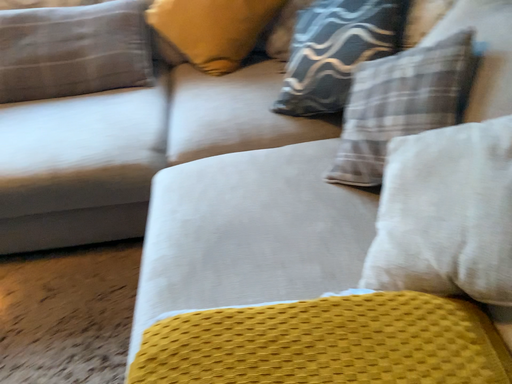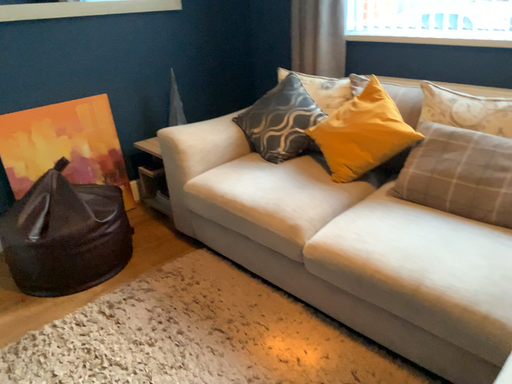
Question: Which way did the camera rotate in the video?

Choices:
 (A) rotated upward
 (B) rotated downward

Answer: (A)